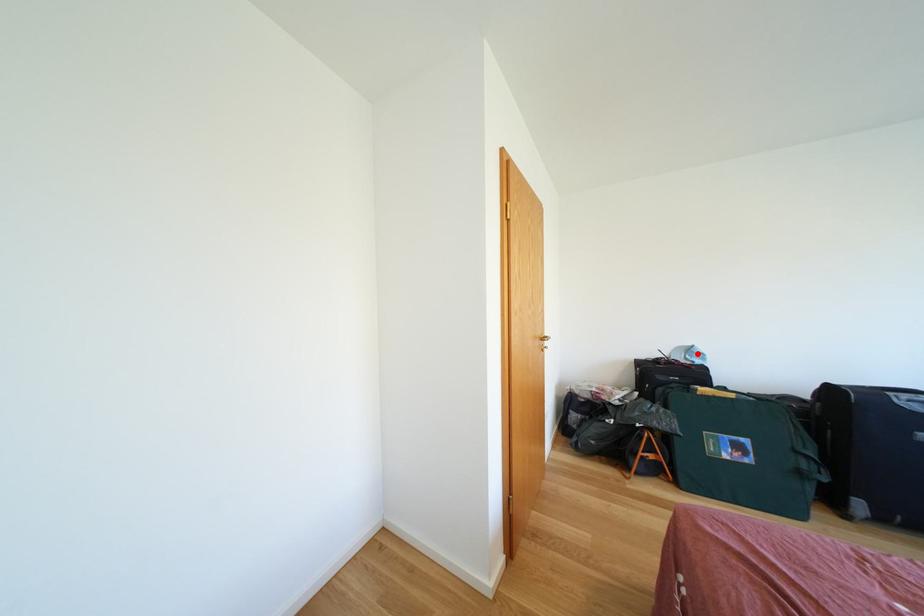
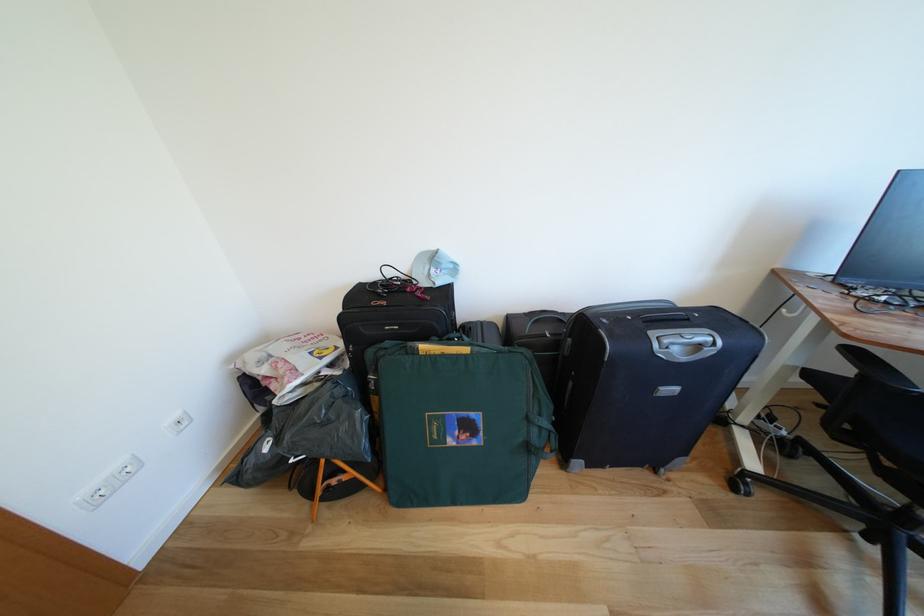
Where in the second image is the point corresponding to the highlighted location from the first image?

(442, 262)